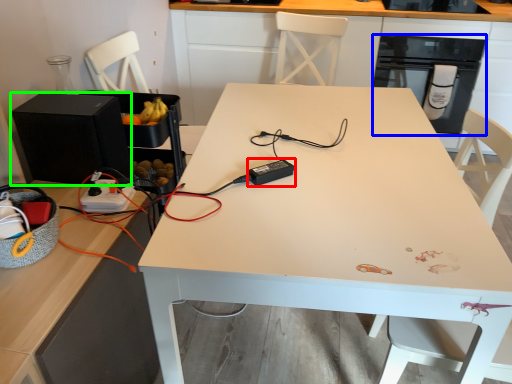
Question: Estimate the real-world distances between objects in this image. Which object is closer to appliance (highlighted by a red box), dish washer (highlighted by a blue box) or appliance (highlighted by a green box)?

Choices:
 (A) dish washer
 (B) appliance

Answer: (B)